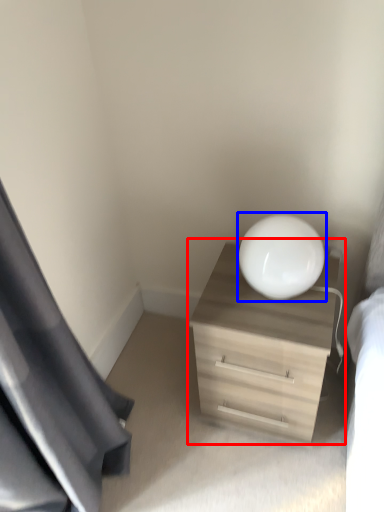
Question: Which of the following is the farthest to the observer, dresser (highlighted by a red box) or round table (highlighted by a blue box)?

Choices:
 (A) dresser
 (B) round table

Answer: (A)